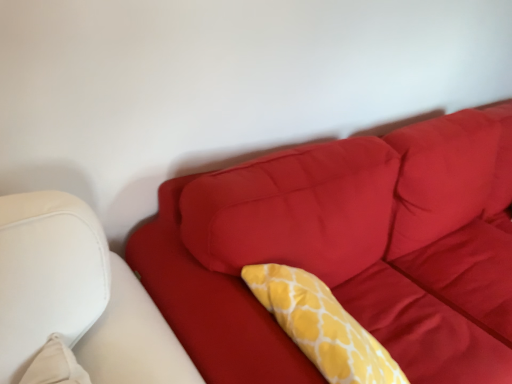
What do you see at coordinates (336, 259) in the screenshot? Image resolution: width=512 pixels, height=384 pixels. I see `matte red couch at center` at bounding box center [336, 259].

This screenshot has width=512, height=384. In order to click on matte red couch at center in this screenshot , I will do `click(336, 259)`.

Find the location of a particular element. The width and height of the screenshot is (512, 384). matte red couch at center is located at coordinates (336, 259).